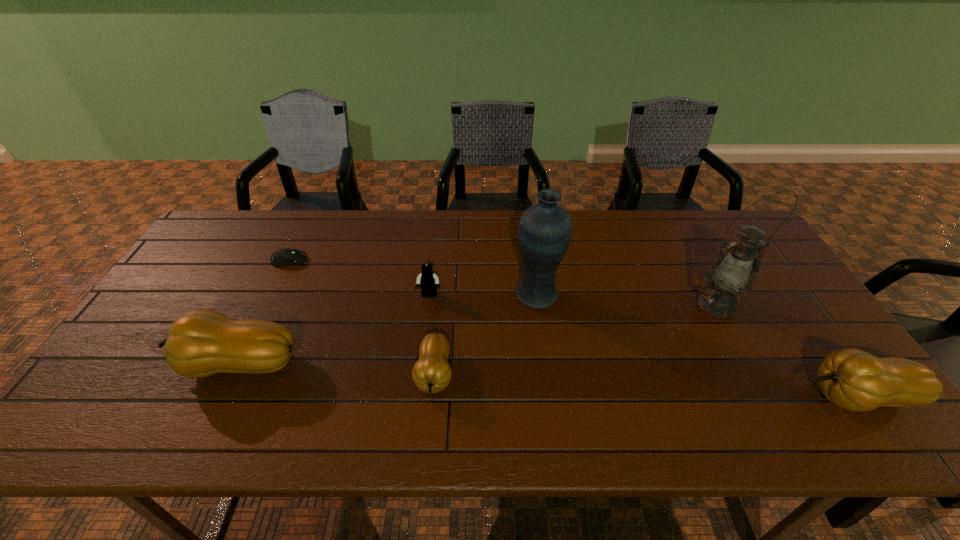
Identify the location of Lego. The width and height of the screenshot is (960, 540). (429, 281).

I want to click on free space located on the stem side of the leftmost gourd, so click(x=136, y=364).

Image resolution: width=960 pixels, height=540 pixels. I want to click on vacant space situated 0.120m on the stem side of the leftmost gourd, so click(125, 364).

This screenshot has height=540, width=960. What are the coordinates of `vacant space situated on the stem side of the second shortest gourd` in the screenshot? It's located at (774, 397).

Where is `free space located 0.290m on the stem side of the second shortest gourd`? This screenshot has height=540, width=960. free space located 0.290m on the stem side of the second shortest gourd is located at coordinates (675, 397).

Where is `free space located 0.400m on the stem side of the second shortest gourd`? This screenshot has width=960, height=540. free space located 0.400m on the stem side of the second shortest gourd is located at coordinates (628, 397).

You are a GUI agent. You are given a task and a screenshot of the screen. Output one action in this format:
    pyautogui.click(x=<x>, y=<y>)
    Task: Click on the vacant space located 0.090m on the button of the farthest object
    
    Given the screenshot: What is the action you would take?
    pyautogui.click(x=335, y=260)

Find the location of a particular element. free region located 0.150m on the front of the sixth object from left to right is located at coordinates (749, 363).

Find the location of a particular element. This screenshot has height=540, width=960. vacant space located on the left of the vase is located at coordinates (438, 295).

Identify the location of vacant space located 0.070m on the front-facing side of the Lego. (426, 319).